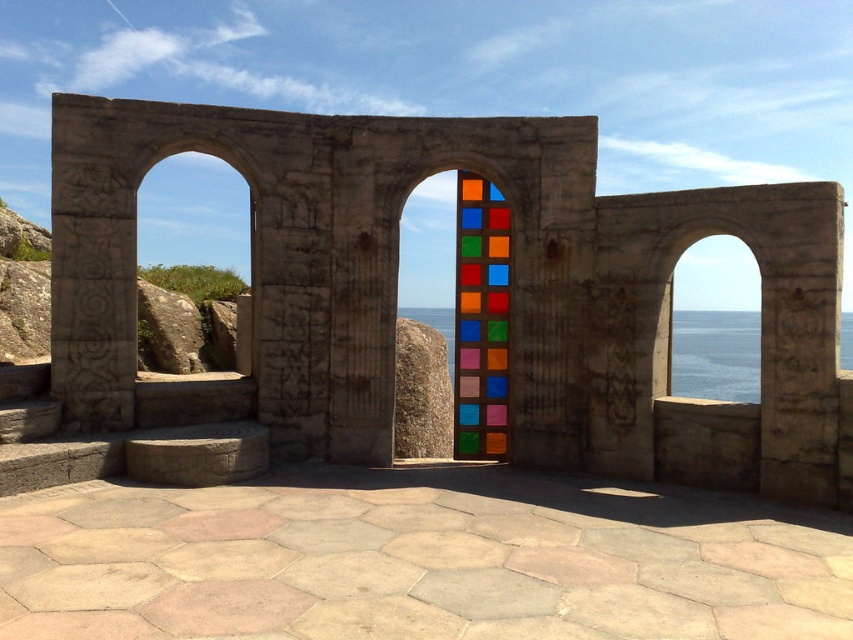
You are an architect designing a new building and want to incorporate elements from this scene. You need to know the relative heights of the multicolored glass door at center and the transparent glass water at center. Which one is taller?

The transparent glass water at center is taller than the multicolored glass door at center.

You are standing in front of the architectural structure described. You want to take a photo of the transparent glass water at center without any obstructions. Considering the distance, can you use a standard smartphone camera to capture it clearly?

The transparent glass water at center is 7.71 meters away from the camera. A standard smartphone camera typically has a maximum effective range of around 5 meters for clear focus on such a subject. Therefore, capturing it clearly without obstructions might be challenging due to the distance.